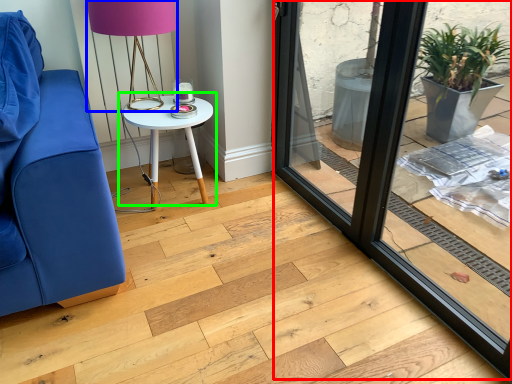
Question: Which is nearer to the window frame (highlighted by a red box)? table lamp (highlighted by a blue box) or table (highlighted by a green box).

Choices:
 (A) table lamp
 (B) table

Answer: (B)